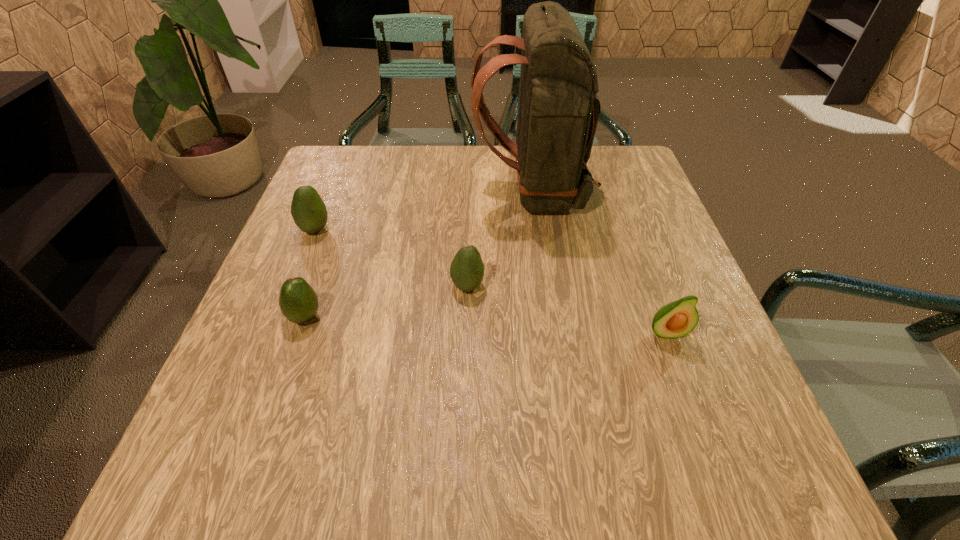
Where is `the second closest object to the rightmost object`? The width and height of the screenshot is (960, 540). the second closest object to the rightmost object is located at coordinates (467, 269).

Image resolution: width=960 pixels, height=540 pixels. What are the coordinates of `object identified as the fourth closest to the second farthest avocado` in the screenshot? It's located at (308, 210).

Select which avocado is the fourth closest to the backpack. Please provide its 2D coordinates. Your answer should be formatted as a tuple, i.e. [(x, y)], where the tuple contains the x and y coordinates of a point satisfying the conditions above.

[(298, 301)]

You are a GUI agent. You are given a task and a screenshot of the screen. Output one action in this format:
    pyautogui.click(x=<x>, y=<y>)
    Task: Click on the avocado that stands as the second closest to the farthest avocado
    
    Given the screenshot: What is the action you would take?
    tap(467, 269)